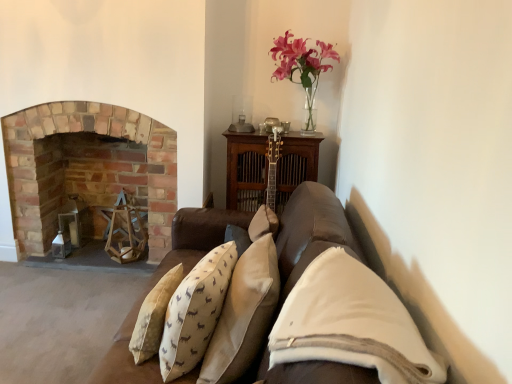
Question: Is beige velvet pillow at center, the first pillow viewed from the left, wider or thinner than brick fireplace at left?

Choices:
 (A) wide
 (B) thin

Answer: (B)

Question: Considering the positions of point (189, 362) and point (74, 192), is point (189, 362) closer or farther from the camera than point (74, 192)?

Choices:
 (A) farther
 (B) closer

Answer: (B)

Question: Estimate the real-world distances between objects in this image. Which object is closer to the beige velvet pillow at center, the first pillow viewed from the left?

Choices:
 (A) white soft pillow at center, the third pillow viewed from the left
 (B) beige cotton pillow at center, which is the 2th pillow in right-to-left order
 (C) brick fireplace at left
 (D) pink glass vase at upper center

Answer: (B)

Question: Which of these objects is positioned closest to the beige cotton pillow at center, placed as the second pillow when sorted from left to right?

Choices:
 (A) brick fireplace at left
 (B) white soft pillow at center, the third pillow viewed from the left
 (C) pink glass vase at upper center
 (D) beige velvet pillow at center, the first pillow viewed from the left

Answer: (D)